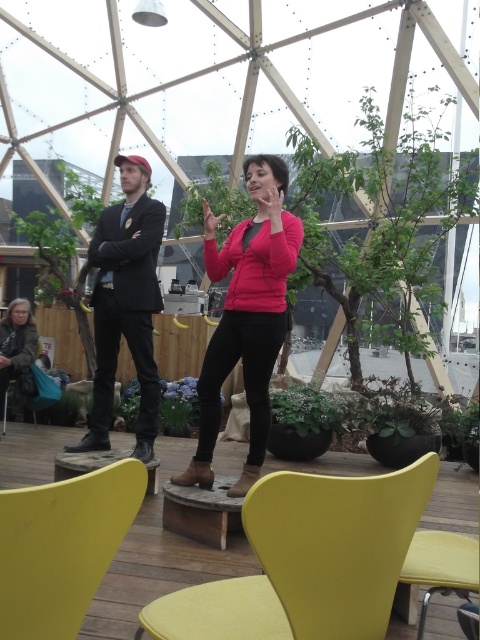
You are a photographer positioned at the entrance of the dome structure. You want to take a photo that includes both the matte pink sweater at center and the yellow fabric chair at lower right. Which object should you adjust your camera angle to focus on first to ensure both are in frame?

The matte pink sweater at center is closer to you than the yellow fabric chair at lower right, so you should focus on the matte pink sweater at center first to ensure both are in frame.